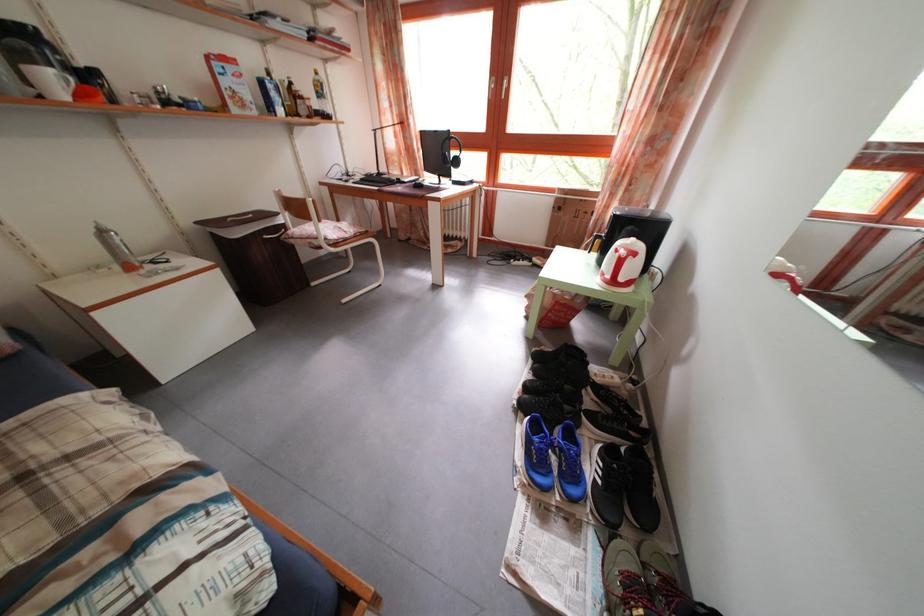
You are a GUI agent. You are given a task and a screenshot of the screen. Output one action in this format:
    pyautogui.click(x=<x>, y=<y>)
    Task: Click on the white mug
    The width and height of the screenshot is (924, 616).
    Given the screenshot: What is the action you would take?
    pyautogui.click(x=50, y=82)